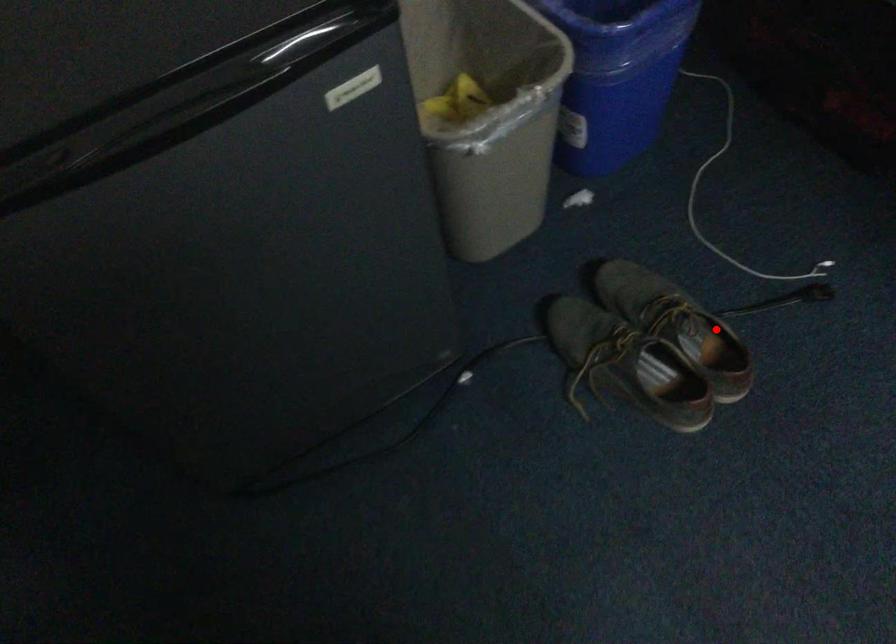
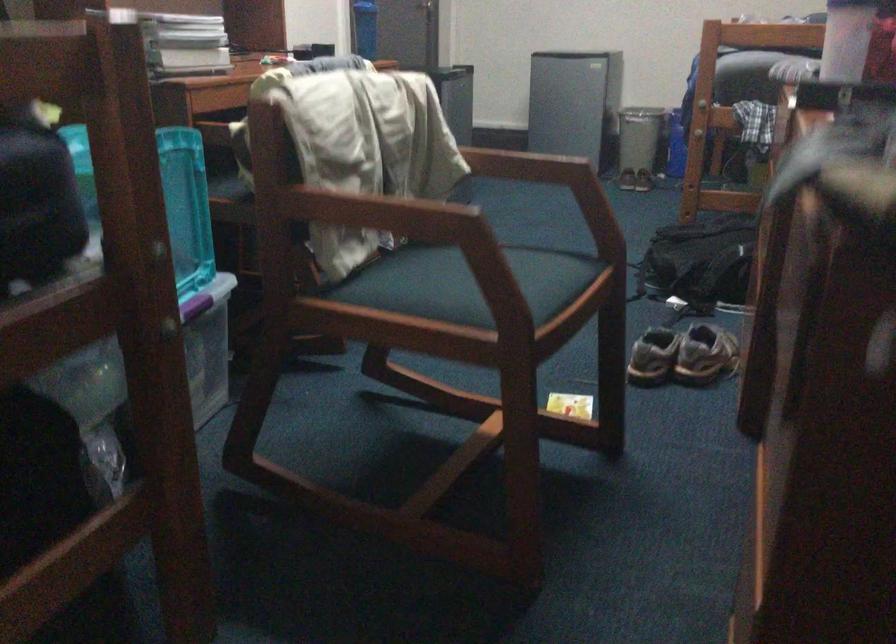
In the second image, find the point that corresponds to the highlighted location in the first image.

(638, 146)